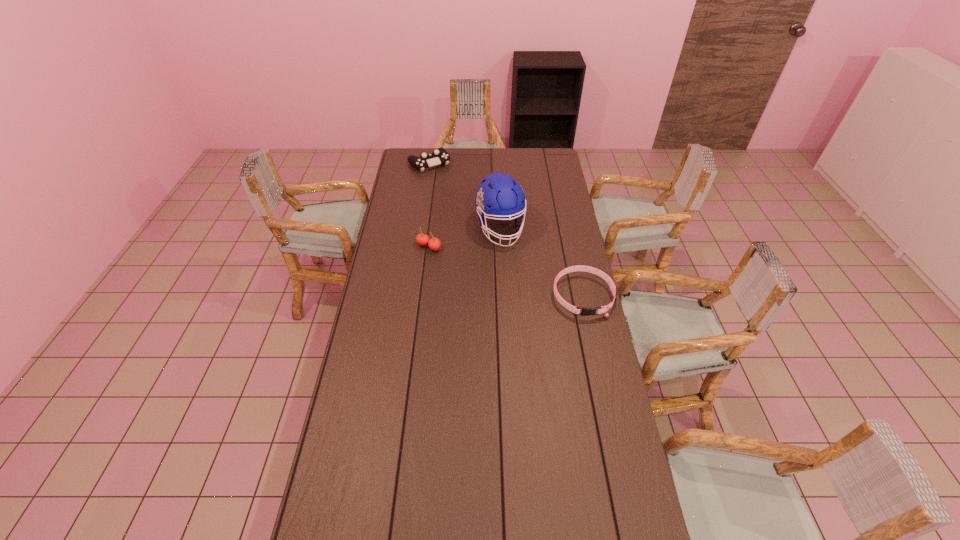
The width and height of the screenshot is (960, 540). I want to click on free spot between the football helmet and the cherry, so click(x=465, y=238).

Identify the location of empty space between the cherry and the second shortest object. This screenshot has height=540, width=960. (429, 205).

This screenshot has height=540, width=960. Find the location of `unoccupied area between the second shortest object and the tallest object`. unoccupied area between the second shortest object and the tallest object is located at coordinates (465, 196).

Image resolution: width=960 pixels, height=540 pixels. What are the coordinates of `vacant area that lies between the football helmet and the farthest object` in the screenshot? It's located at (465, 196).

Locate which object ranks third in proximity to the dog collar. Please provide its 2D coordinates. Your answer should be formatted as a tuple, i.e. [(x, y)], where the tuple contains the x and y coordinates of a point satisfying the conditions above.

[(440, 156)]

Choose which object is the third nearest neighbor to the tallest object. Please provide its 2D coordinates. Your answer should be formatted as a tuple, i.e. [(x, y)], where the tuple contains the x and y coordinates of a point satisfying the conditions above.

[(440, 156)]